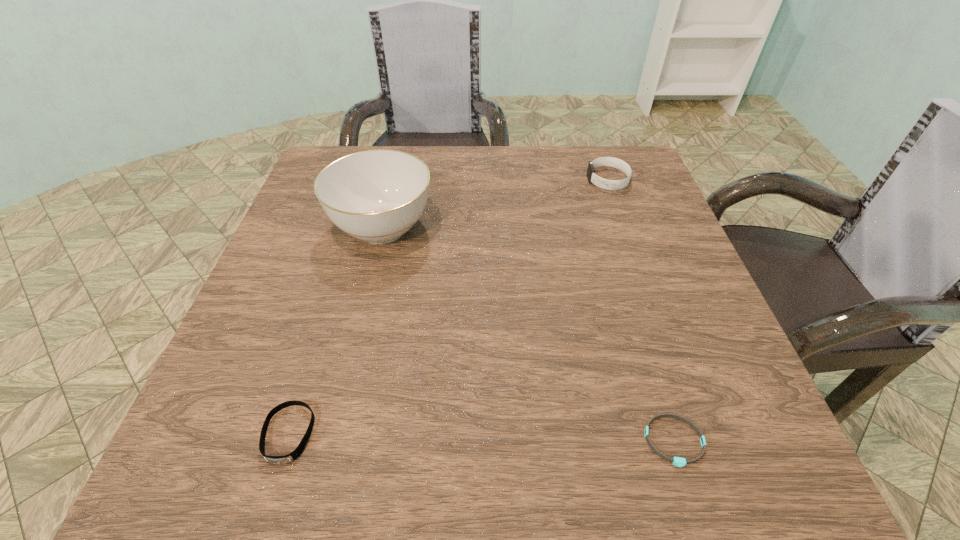
Find the location of a particular element. vacant position located 0.070m on the outer surface of the farthest object is located at coordinates (560, 180).

You are a GUI agent. You are given a task and a screenshot of the screen. Output one action in this format:
    pyautogui.click(x=<x>, y=<y>)
    Task: Click on the chinaware that is at the far edge
    The height and width of the screenshot is (540, 960).
    Given the screenshot: What is the action you would take?
    pyautogui.click(x=377, y=196)

Locate an element on the screen. This screenshot has width=960, height=540. wristband that is positioned at the far edge is located at coordinates (603, 183).

This screenshot has height=540, width=960. In order to click on chinaware that is at the left edge in this screenshot , I will do `click(377, 196)`.

Find the location of a particular element. The height and width of the screenshot is (540, 960). wristband present at the left edge is located at coordinates (278, 460).

Image resolution: width=960 pixels, height=540 pixels. In order to click on object that is at the far left corner in this screenshot , I will do `click(377, 196)`.

Find the location of a particular element. object located at the near left corner is located at coordinates (278, 460).

Where is `object at the far right corner`? The width and height of the screenshot is (960, 540). object at the far right corner is located at coordinates point(603,183).

This screenshot has width=960, height=540. In order to click on object at the near right corner in this screenshot , I will do `click(677, 461)`.

The width and height of the screenshot is (960, 540). Identify the location of vacant region at the far edge of the desktop. (585, 188).